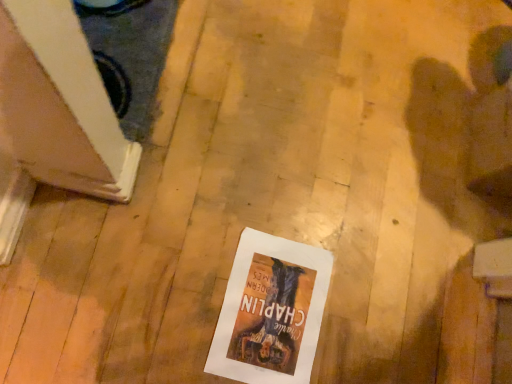
You are a GUI agent. You are given a task and a screenshot of the screen. Output one action in this format:
    pyautogui.click(x=<x>, y=<y>)
    Task: Click on the vacant area to the left of white paper poster at center
    The height and width of the screenshot is (384, 512).
    Given the screenshot: What is the action you would take?
    pyautogui.click(x=172, y=271)